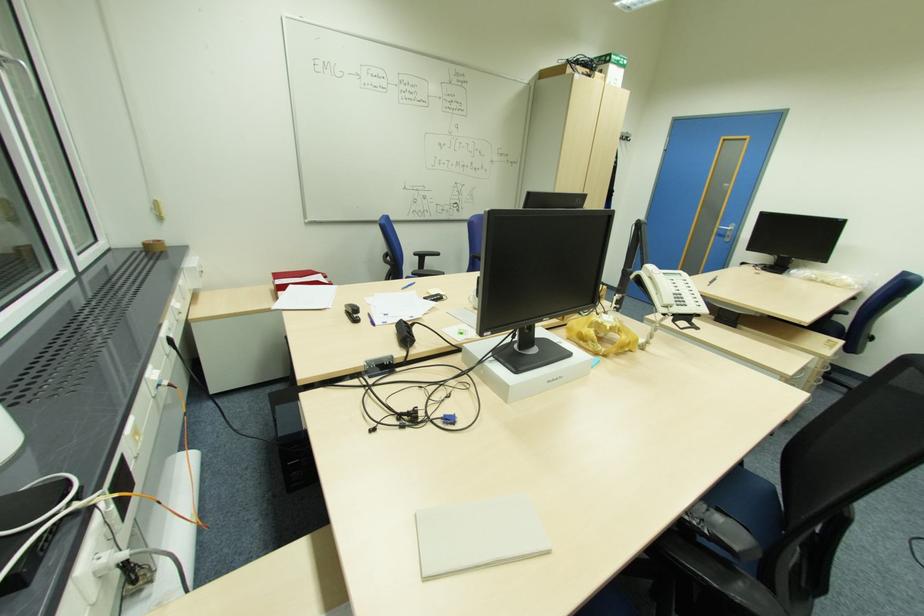
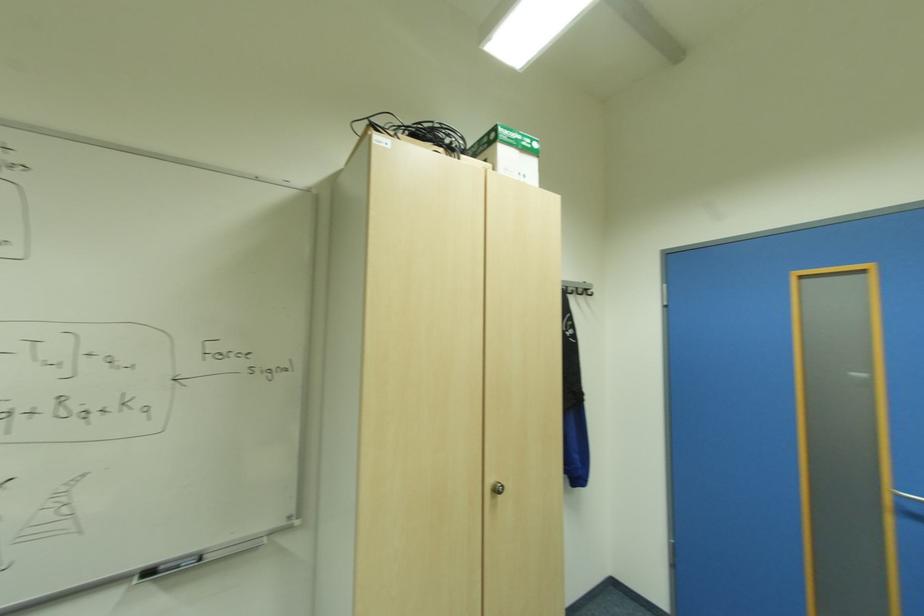
Locate, in the second image, the point that corresponds to the point at 629,138 in the first image.

(588, 291)